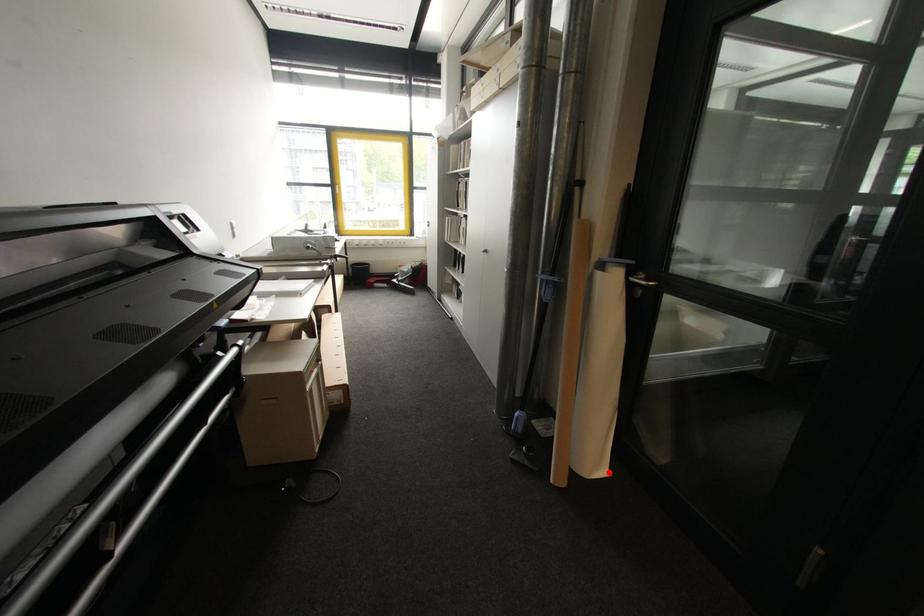
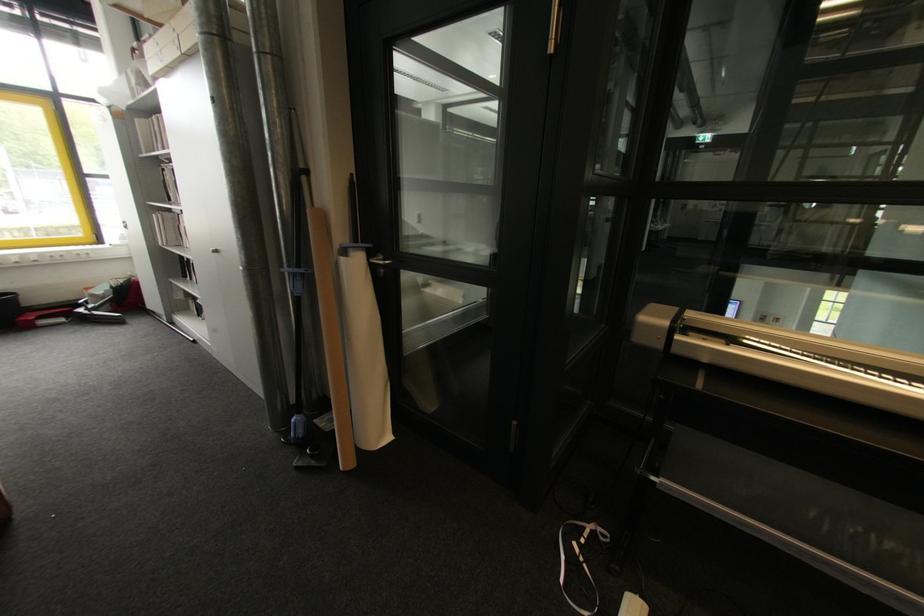
Where in the second image is the point corresponding to the highlighted location from the first image?

(393, 438)